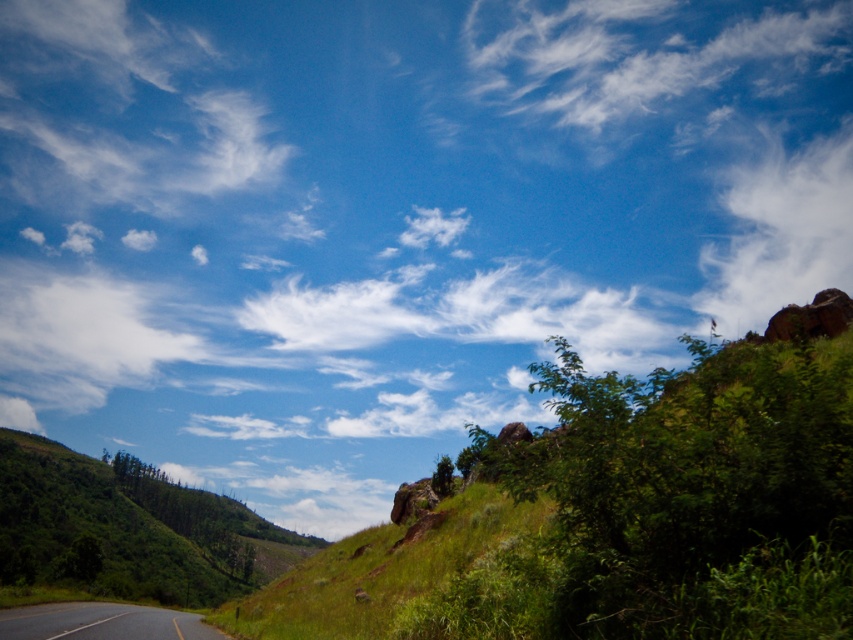
You are a drone operator planning to fly a drone from the white wispy cloud at upper center to the black asphalt road at lower left. Based on the scene, which object is higher in elevation?

The white wispy cloud at upper center is taller than the black asphalt road at lower left, so the white wispy cloud at upper center is higher in elevation.

You are a photographer planning to capture the entire black asphalt road at lower left and white fluffy cloud at upper center in one shot. Based on the scene, which of these two elements will appear wider in the photograph?

The white fluffy cloud at upper center will appear wider in the photograph since its width surpasses that of the black asphalt road at lower left according to the description.

You are a drone operator planning to fly a drone from the black asphalt road at lower left to the white fluffy cloud at upper center. Considering their positions, can you determine if the drone will need to ascend or descend to reach the cloud?

The white fluffy cloud at upper center is taller than the black asphalt road at lower left, so the drone will need to ascend to reach the white fluffy cloud at upper center.